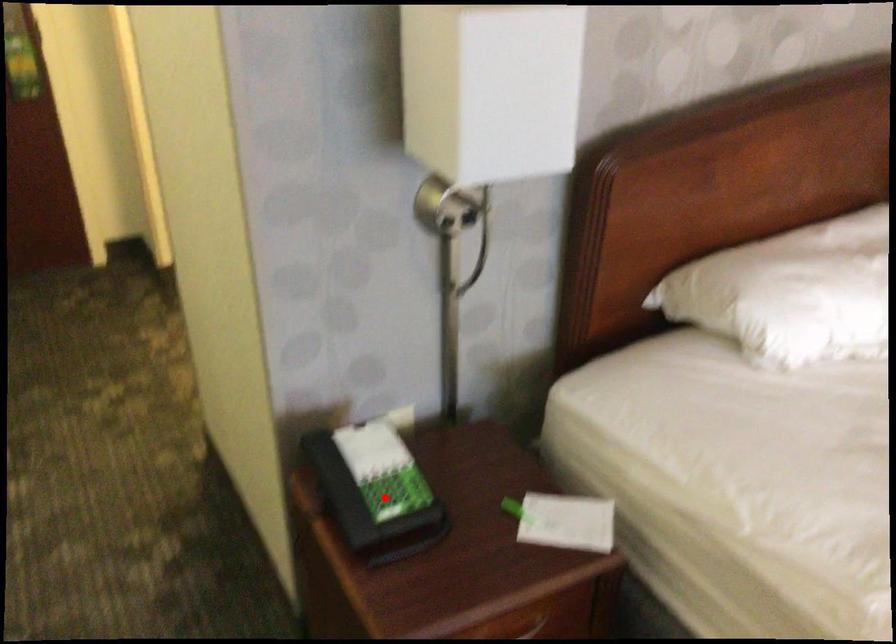
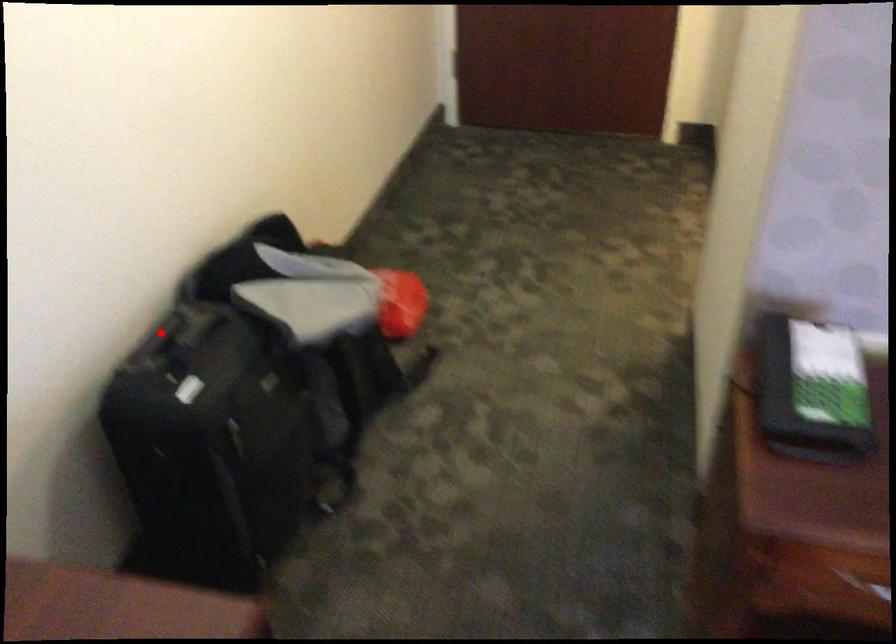
I am providing you with two images of the same scene from different viewpoints. A red point is marked on the first image and another point is marked on the second image. Is the red point in image1 aligned with the point shown in image2?

No